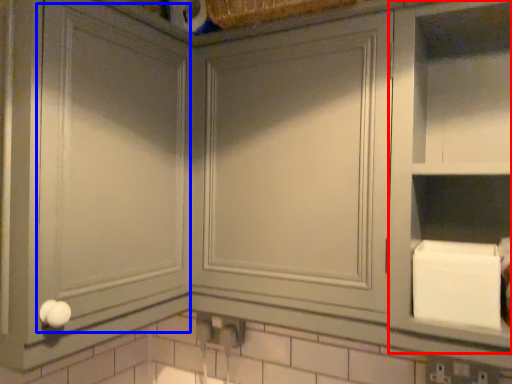
Question: Which object is closer to the camera taking this photo, cabinet (highlighted by a red box) or glass door (highlighted by a blue box)?

Choices:
 (A) cabinet
 (B) glass door

Answer: (B)